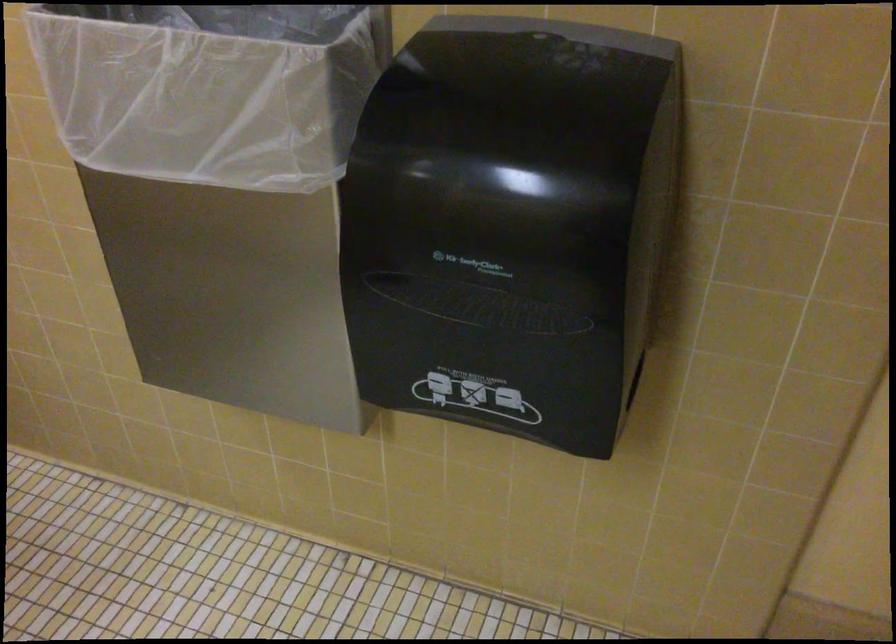
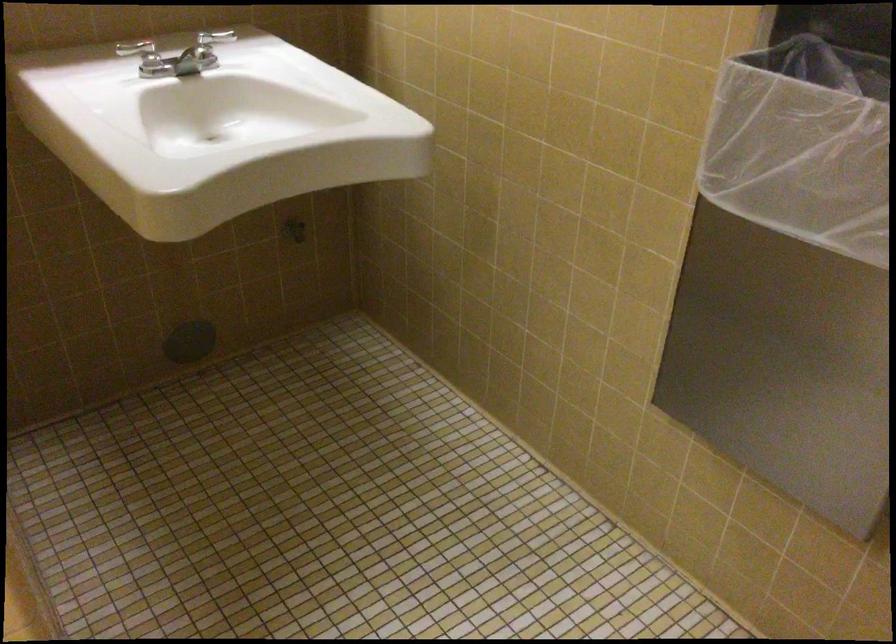
Question: The images are taken continuously from a first-person perspective. In which direction is your viewpoint rotating?

Choices:
 (A) Left
 (B) Right
 (C) Up
 (D) Down

Answer: (A)